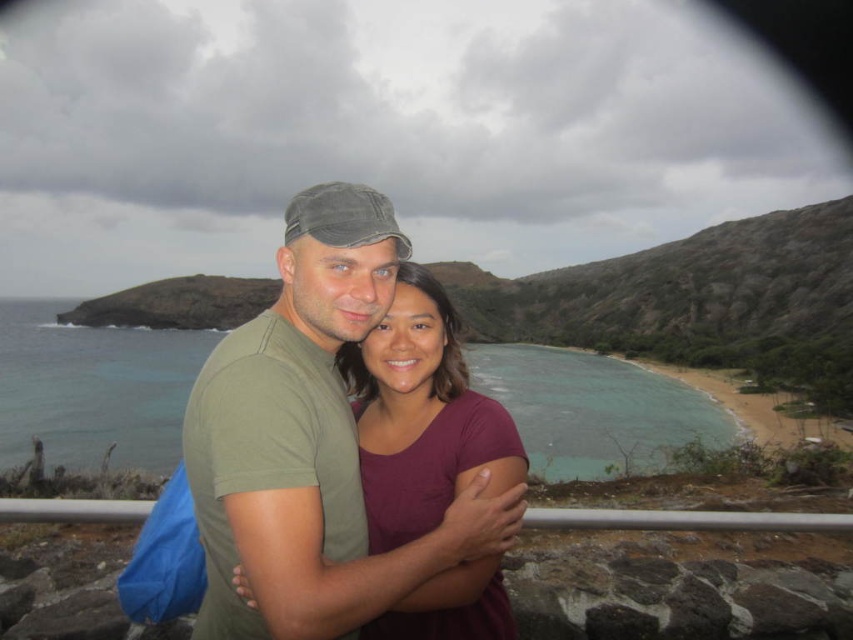
You are a photographer trying to capture the couple in the scene. You notice two points marked on your camera screen at coordinates point (386, 212) and point (486, 387). Which point is closer to the couple?

Point (386, 212) is in front of point (486, 387), so it is closer to the couple.